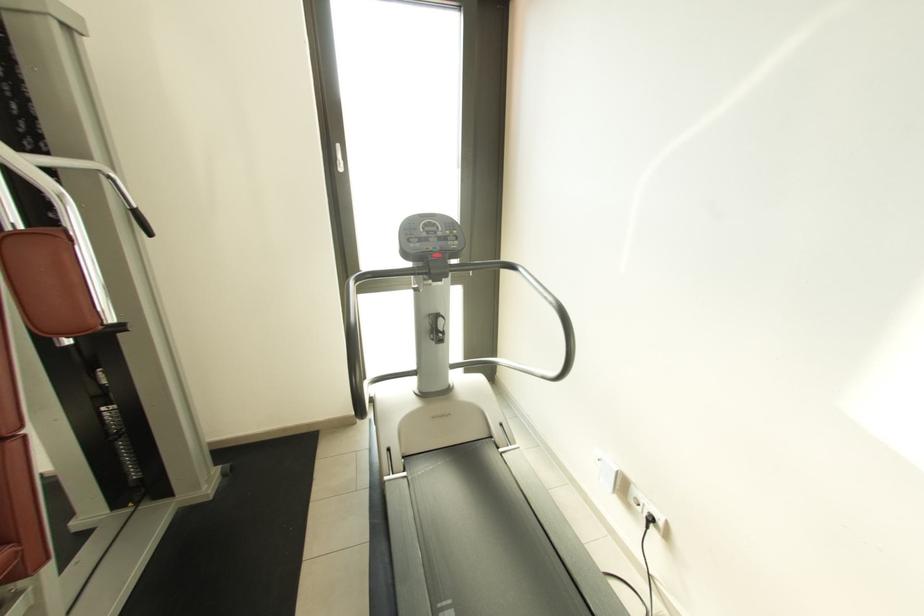
Find where to turn the white door handle. Please return your answer as a coordinate pair (x, y).

(334, 155)